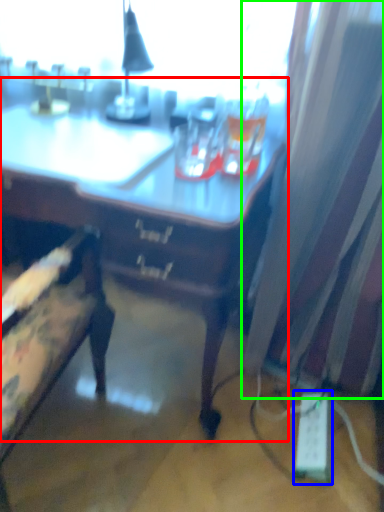
Question: Considering the real-world distances, which object is closest to desk (highlighted by a red box)? extension cord (highlighted by a blue box) or curtain (highlighted by a green box).

Choices:
 (A) extension cord
 (B) curtain

Answer: (B)